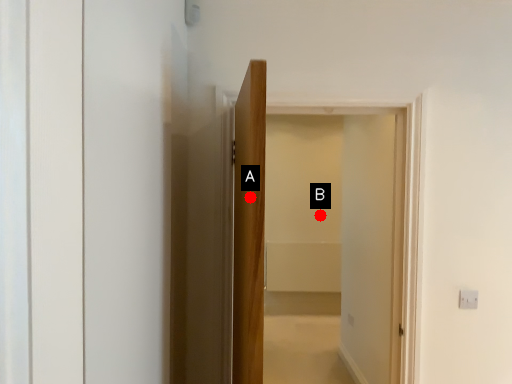
Question: Two points are circled on the image, labeled by A and B beside each circle. Which point is closer to the camera taking this photo?

Choices:
 (A) A is closer
 (B) B is closer

Answer: (A)